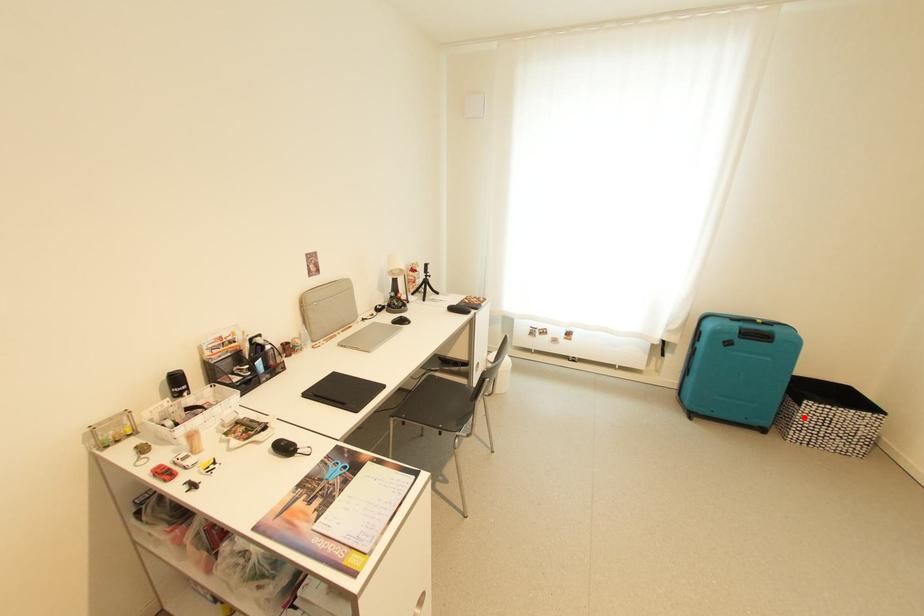
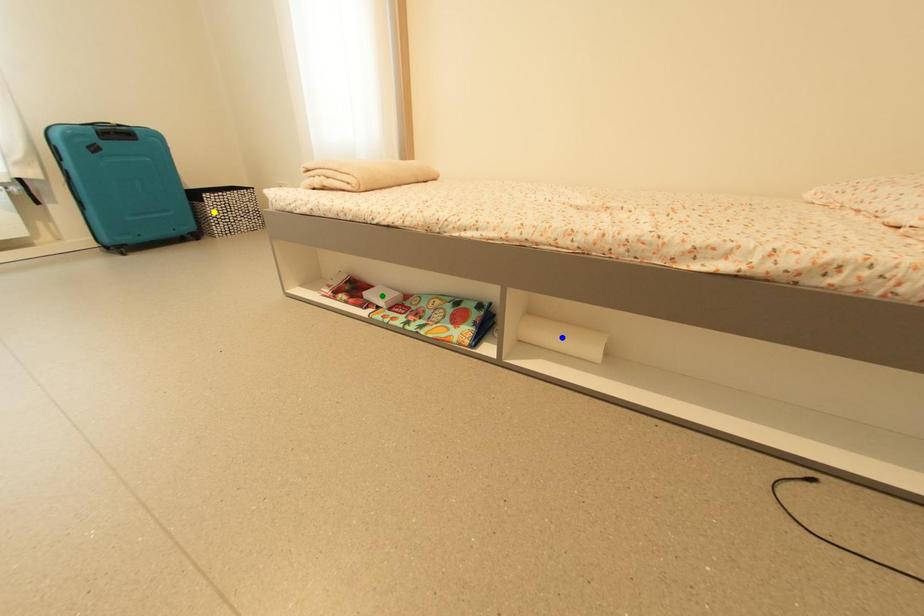
Question: I am providing you with two images of the same scene from different viewpoints. A red point is marked on the first image. You are given multiple points on the second image. Which spot in image 2 lines up with the point in image 1?

Choices:
 (A) green point
 (B) blue point
 (C) yellow point

Answer: (C)